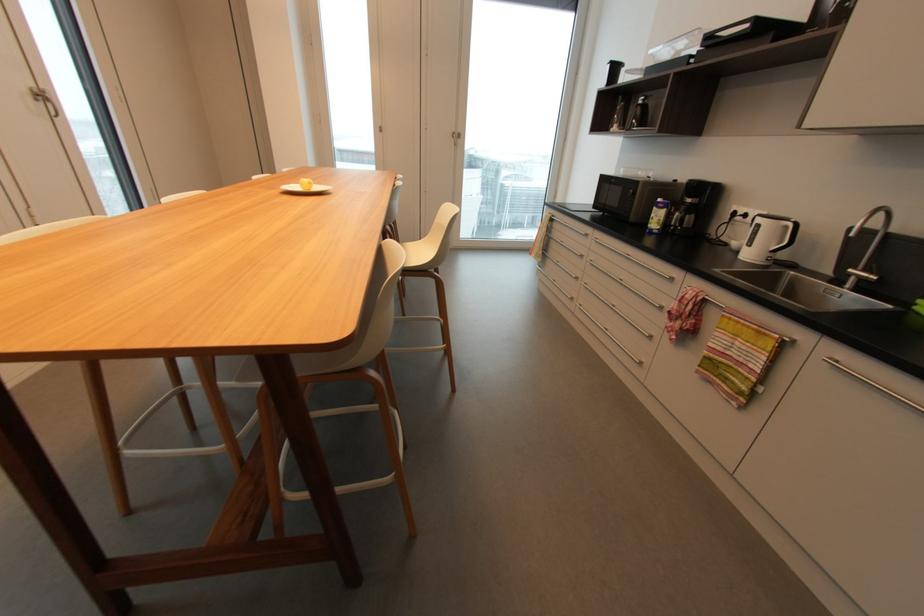
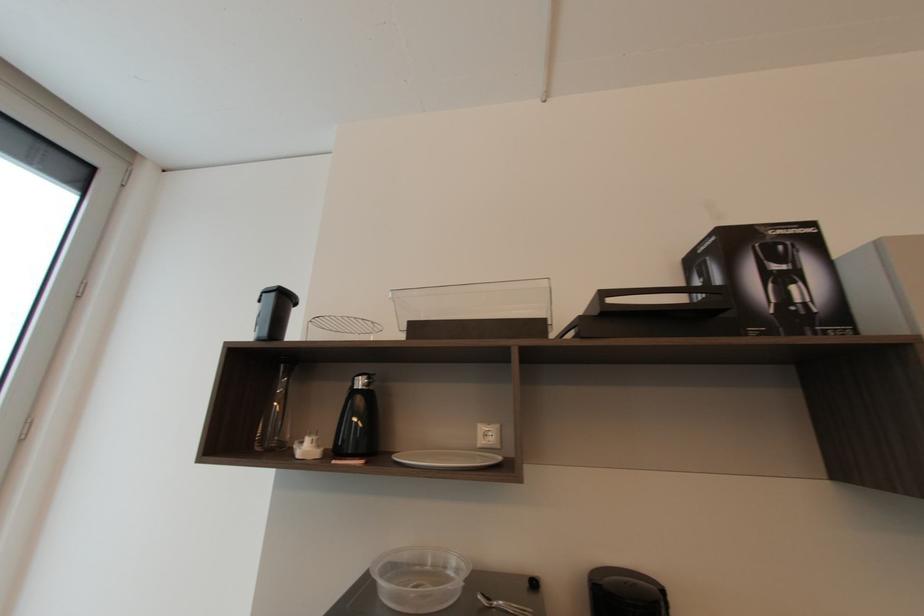
In the second image, find the point that corresponds to (618,128) in the first image.

(310, 447)